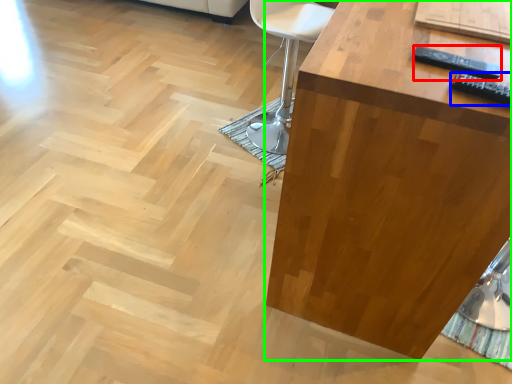
Question: Based on their relative distances, which object is nearer to remote (highlighted by a red box)? Choose from remote (highlighted by a blue box) and table (highlighted by a green box).

Choices:
 (A) remote
 (B) table

Answer: (A)